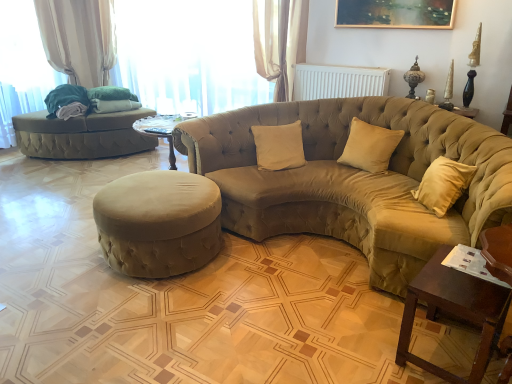
Image resolution: width=512 pixels, height=384 pixels. I want to click on free space that is to the left of wooden table at lower right, so click(x=371, y=351).